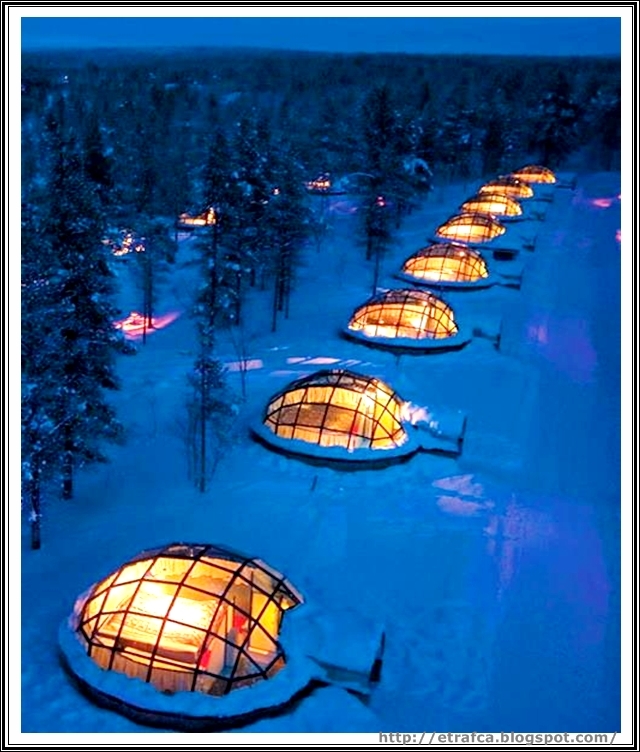
The width and height of the screenshot is (640, 752). In order to click on door in this screenshot , I will do `click(377, 669)`.